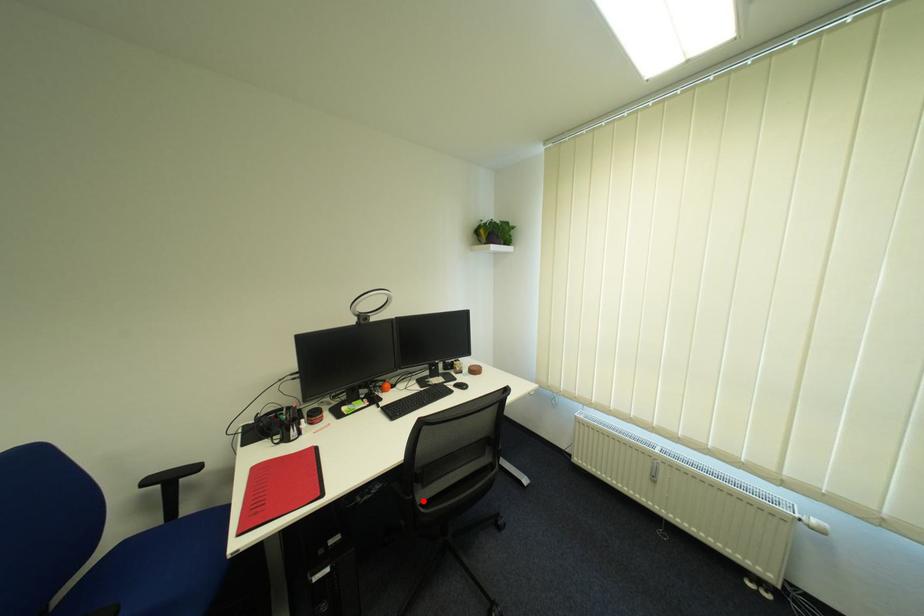
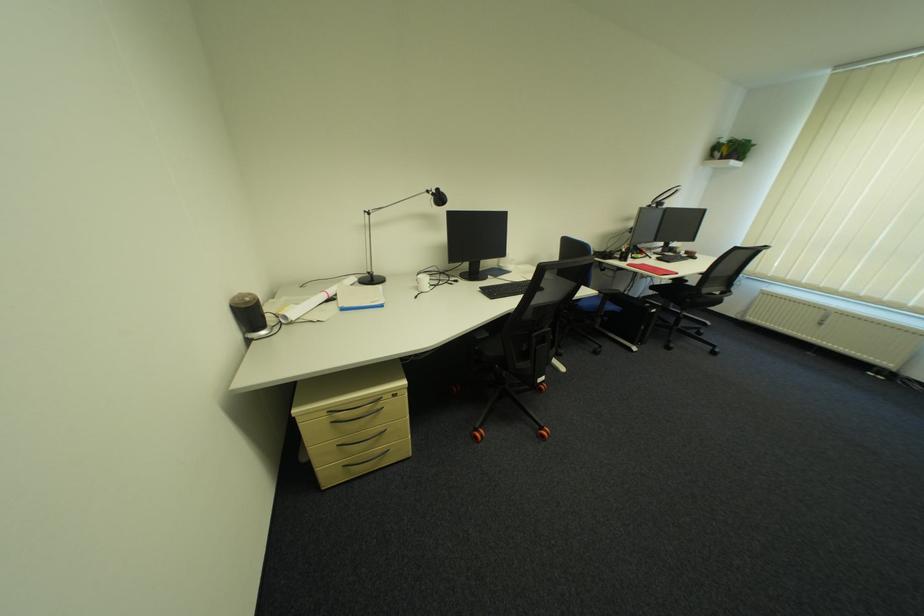
Find the pixel in the second image that matches the highlighted location in the first image.

(711, 291)